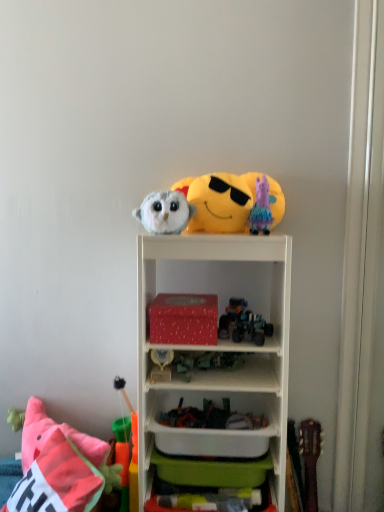
Question: Is point (153, 307) positioned closer to the camera than point (140, 268)?

Choices:
 (A) closer
 (B) farther

Answer: (B)

Question: Would you say red matte box at center is inside or outside white plastic shelf at upper center?

Choices:
 (A) inside
 (B) outside

Answer: (A)

Question: Which of these objects is positioned farthest from the pink fabric unicorn at upper right, which appears as the 7th toy when ordered from the bottom?

Choices:
 (A) green plastic toy at center, which ranks as the third toy in bottom-to-top order
 (B) shiny metallic robot at center, positioned as the 5th toy in bottom-to-top order
 (C) yellow plush emoji at upper center, which is the 1th toy in top-to-bottom order
 (D) fluffy white owl at upper center, the 3th toy viewed from the top
 (E) fluffy pink pillow at lower left

Answer: (E)

Question: Considering the real-world distances, which object is farthest from the white plastic container at center?

Choices:
 (A) green plastic cup at lower left, which ranks as the 1th toy in bottom-to-top order
 (B) black plastic toy at lower left, the second toy positioned from the bottom
 (C) red matte box at center
 (D) white plastic shelf at upper center
 (E) shiny metallic car at center, which is the 4th toy from bottom to top

Answer: (C)